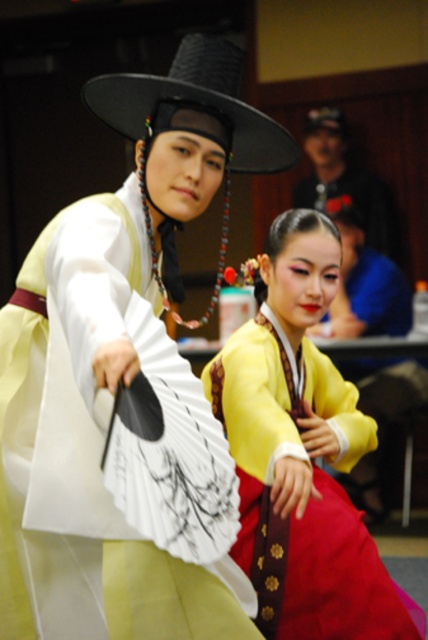
Is yellow satin blouse at center in front of white silk fan at center?

No.

This screenshot has width=428, height=640. Describe the element at coordinates (300, 451) in the screenshot. I see `yellow satin blouse at center` at that location.

Locate an element on the screen. The width and height of the screenshot is (428, 640). yellow satin blouse at center is located at coordinates (300, 451).

Based on the photo, does yellow satin blouse at center appear on the left side of matte black hat at upper center?

Yes, yellow satin blouse at center is to the left of matte black hat at upper center.

Is yellow satin blouse at center positioned before matte black hat at upper center?

Yes.

What do you see at coordinates (300, 451) in the screenshot? This screenshot has width=428, height=640. I see `yellow satin blouse at center` at bounding box center [300, 451].

Find the location of `yellow satin blouse at center`. yellow satin blouse at center is located at coordinates (300, 451).

Find the location of `white silk fan at center`. white silk fan at center is located at coordinates (89, 538).

Does white silk fan at center have a smaller size compared to matte black hat at upper center?

Incorrect, white silk fan at center is not smaller in size than matte black hat at upper center.

Find the location of a particular element. white silk fan at center is located at coordinates coord(89,538).